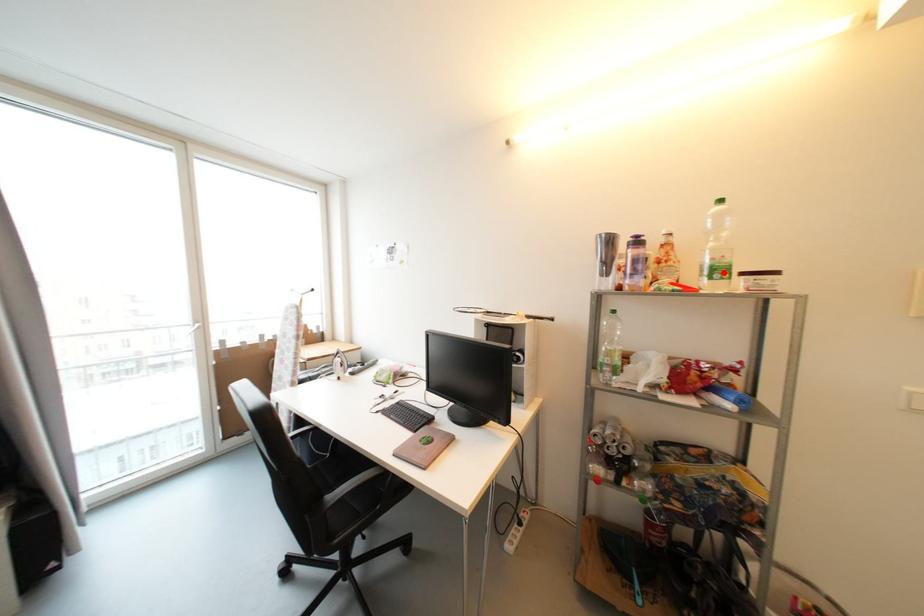
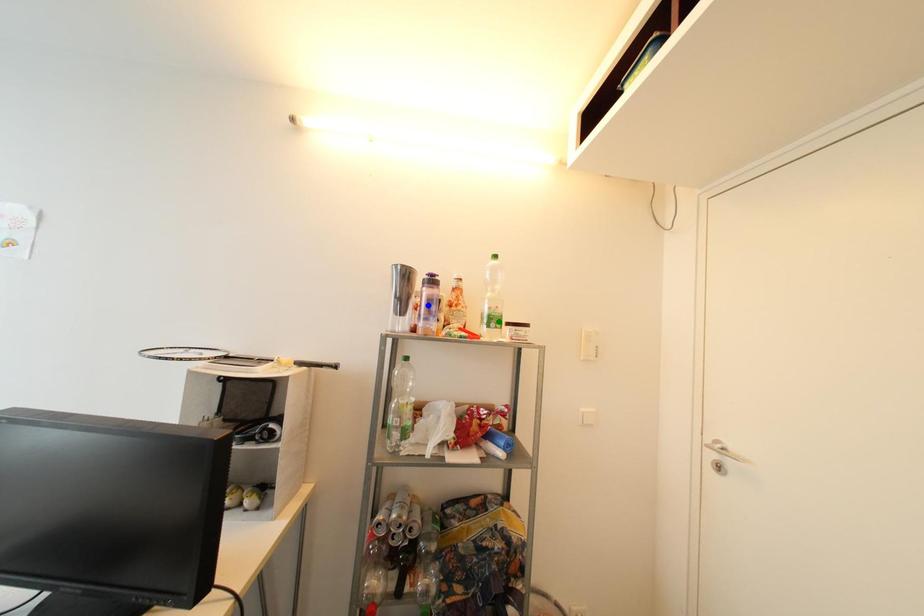
Question: I am providing you with two images of the same scene from different viewpoints. A red point is marked on the first image. You are given multiple points on the second image. In image 2, which mark is for the same physical point as the one in image 1?

Choices:
 (A) yellow point
 (B) green point
 (C) blue point

Answer: (B)